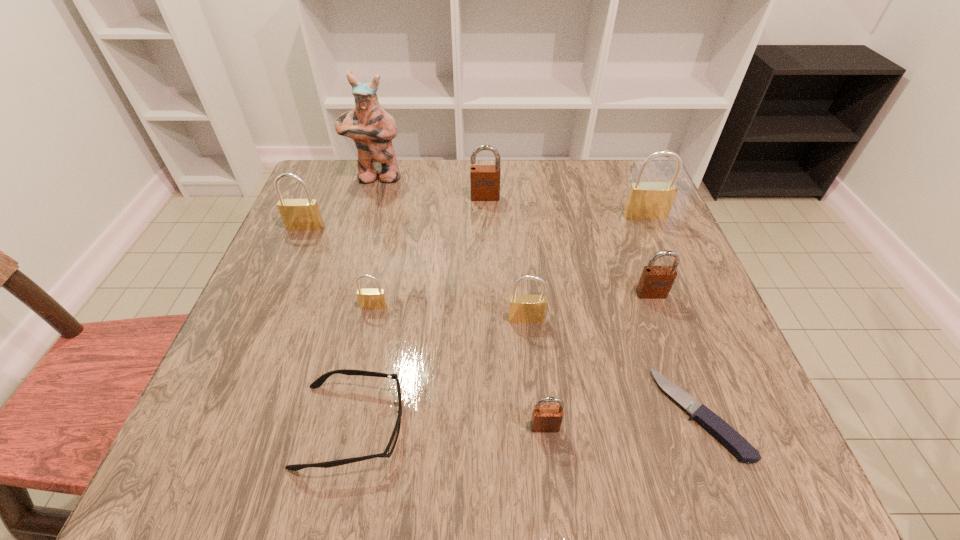
The width and height of the screenshot is (960, 540). I want to click on the farthest object, so click(369, 125).

Find the location of a particular element. Image resolution: width=960 pixels, height=540 pixels. figurine is located at coordinates (369, 125).

At what (x,y) coordinates should I click in order to perform the action: click on the rightmost brass padlock. Please return your answer as a coordinate pair (x, y). The height and width of the screenshot is (540, 960). Looking at the image, I should click on (646, 200).

Locate an element on the screen. This screenshot has height=540, width=960. the tallest padlock is located at coordinates (646, 200).

This screenshot has height=540, width=960. Identify the location of the leftmost object. (297, 214).

Locate an element on the screen. Image resolution: width=960 pixels, height=540 pixels. the second farthest brass padlock is located at coordinates (297, 214).

Find the location of a particular element. the leftmost brown padlock is located at coordinates (484, 179).

I want to click on the fifth padlock from right to left, so click(x=484, y=179).

The height and width of the screenshot is (540, 960). Find the location of `the second nearest brown padlock`. the second nearest brown padlock is located at coordinates (655, 282).

You are a GUI agent. You are given a task and a screenshot of the screen. Output one action in this format:
    pyautogui.click(x=<x>, y=<y>)
    Task: Click on the second biggest brown padlock
    The image size is (960, 540).
    Given the screenshot: What is the action you would take?
    pyautogui.click(x=655, y=282)